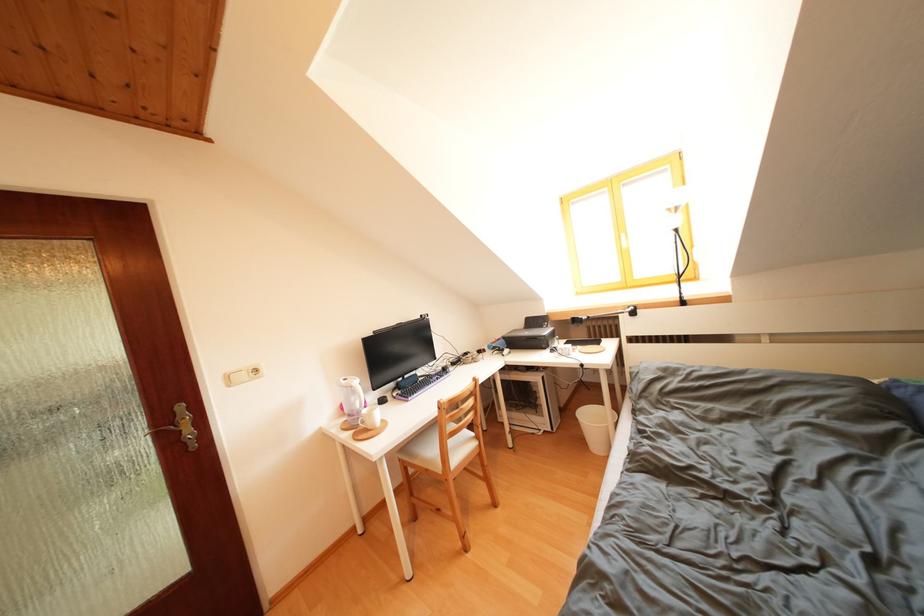
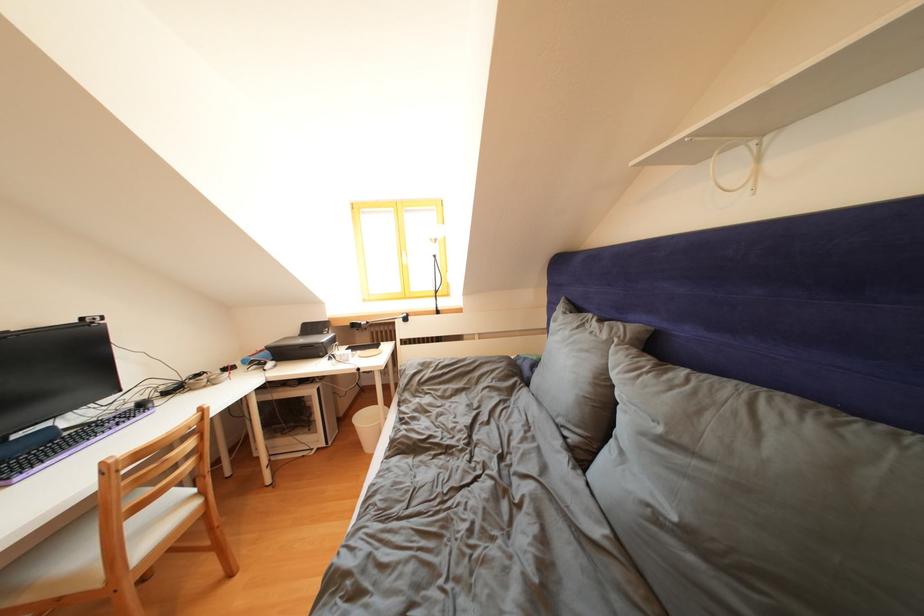
Where in the second image is the point corresponding to [470,451] from the first image?

(175, 522)